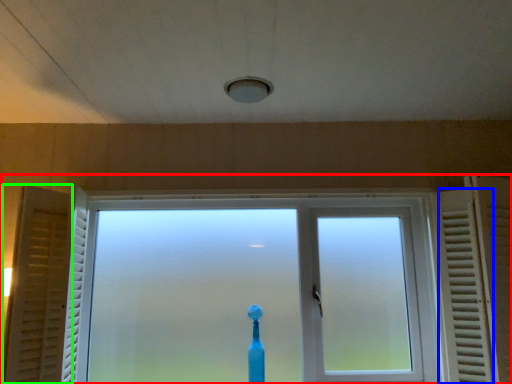
Question: Considering the real-world distances, which object is farthest from window (highlighted by a red box)? radiator (highlighted by a blue box) or curtain (highlighted by a green box)?

Choices:
 (A) radiator
 (B) curtain

Answer: (B)